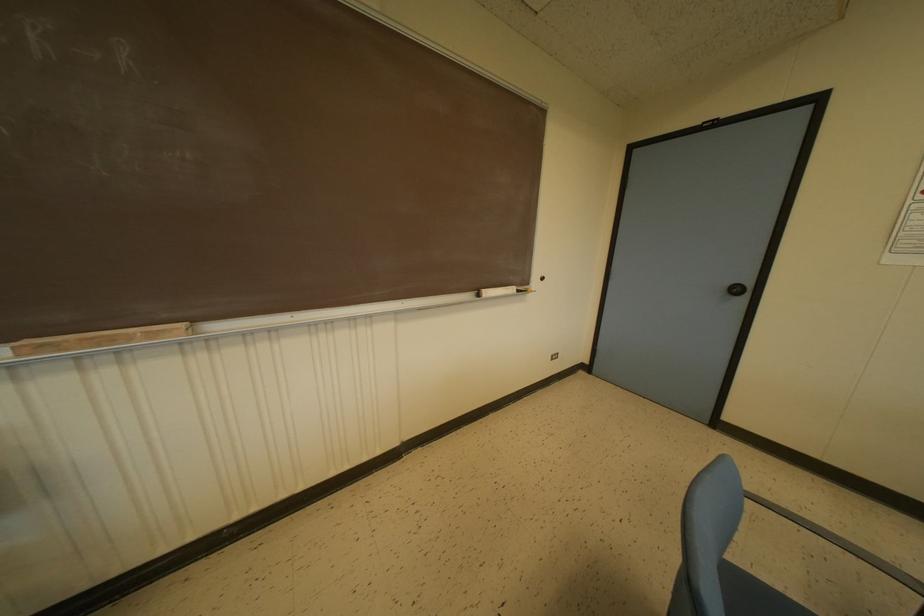
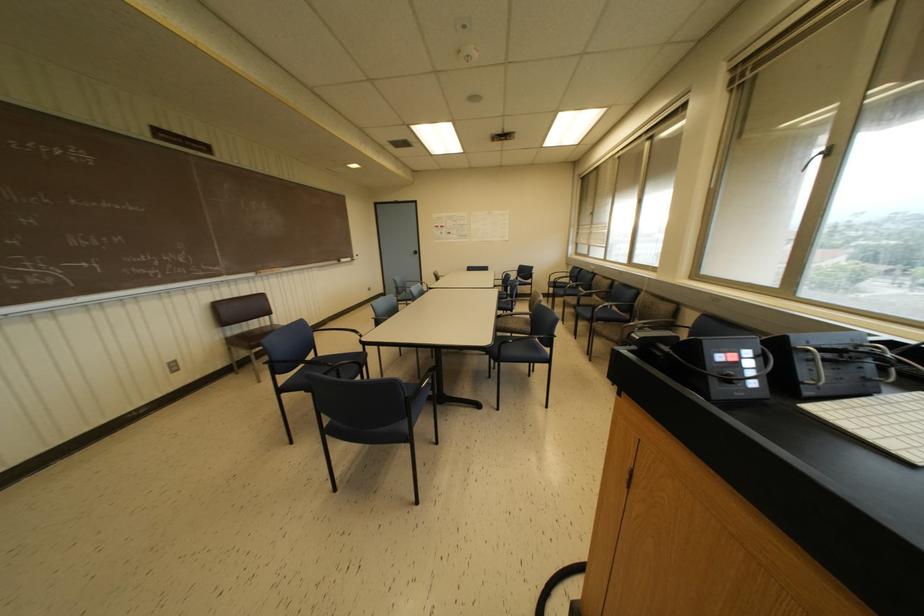
The point at (x=487, y=292) is marked in the first image. Where is the corresponding point in the second image?

(342, 259)